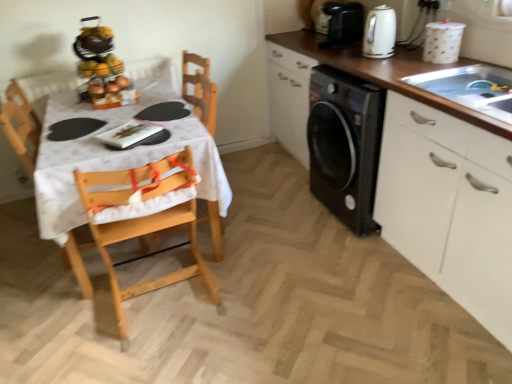
Question: From a real-world perspective, is wooden highchair at left positioned above or below white glossy canister at upper right, the 1th appliance from the bottom?

Choices:
 (A) above
 (B) below

Answer: (B)

Question: Is point (75, 183) closer or farther from the camera than point (428, 41)?

Choices:
 (A) farther
 (B) closer

Answer: (B)

Question: Considering the real-world distances, which object is farthest from the white glossy cabinet at right?

Choices:
 (A) wooden highchair at left
 (B) shiny plastic fruit basket at upper left
 (C) white glossy kettle at upper right
 (D) white glossy canister at upper right, which ranks as the second appliance in back-to-front order
 (E) white fabric tablecloth at left

Answer: (B)

Question: Estimate the real-world distances between objects in this image. Which object is closer to the shiny plastic fruit basket at upper left?

Choices:
 (A) white glossy kettle at upper right
 (B) silver metallic sink at upper right
 (C) white fabric tablecloth at left
 (D) matte black coffee maker at upper right, which is the first appliance from top to bottom
 (E) wooden highchair at left

Answer: (C)